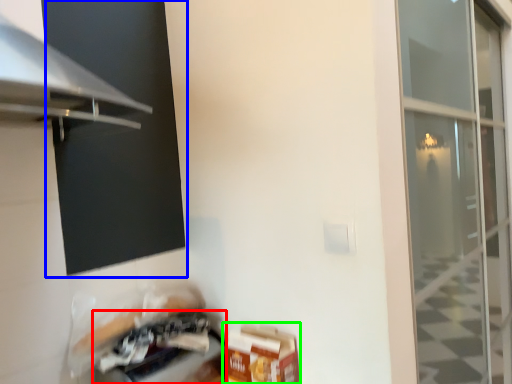
Question: Based on their relative distances, which object is nearer to appliance (highlighted by a red box)? Choose from window screen (highlighted by a blue box) and cardboard box (highlighted by a green box).

Choices:
 (A) window screen
 (B) cardboard box

Answer: (B)